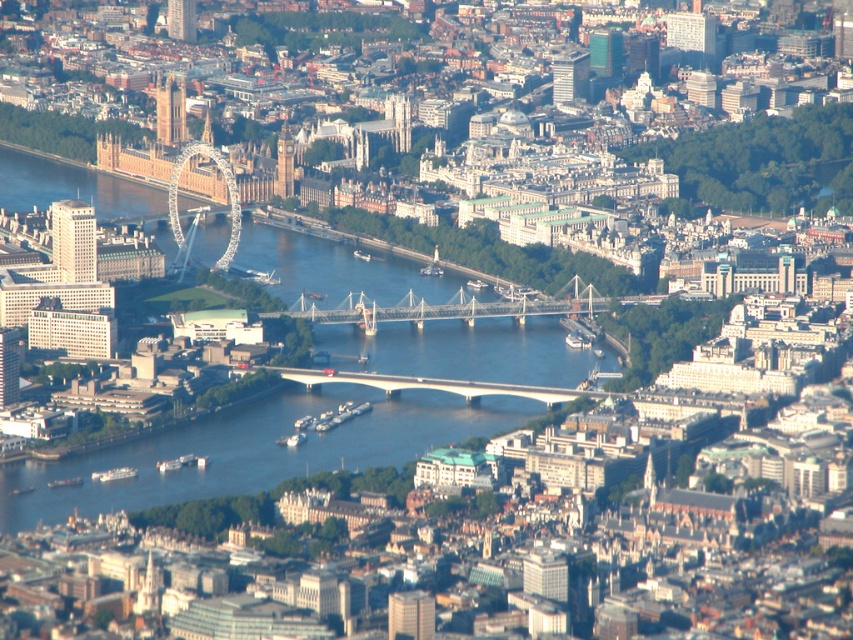
Who is taller, blue water at center or white concrete bridge at center?

blue water at center

How much distance is there between blue water at center and white concrete bridge at center?

blue water at center and white concrete bridge at center are 67.12 feet apart from each other.

Is point (440, 332) farther from viewer compared to point (357, 380)?

That is False.

The image size is (853, 640). Identify the location of blue water at center. (254, 451).

Is metallic gray bridge at center above metallic glass tower bridge at center-left?

Actually, metallic gray bridge at center is below metallic glass tower bridge at center-left.

The height and width of the screenshot is (640, 853). Find the location of `metallic gray bridge at center`. metallic gray bridge at center is located at coordinates click(456, 310).

Is blue water at center closer to the viewer compared to metallic glass tower bridge at center-left?

That is True.

Does blue water at center lie behind metallic glass tower bridge at center-left?

No.

Locate an element on the screen. The image size is (853, 640). blue water at center is located at coordinates (x=254, y=451).